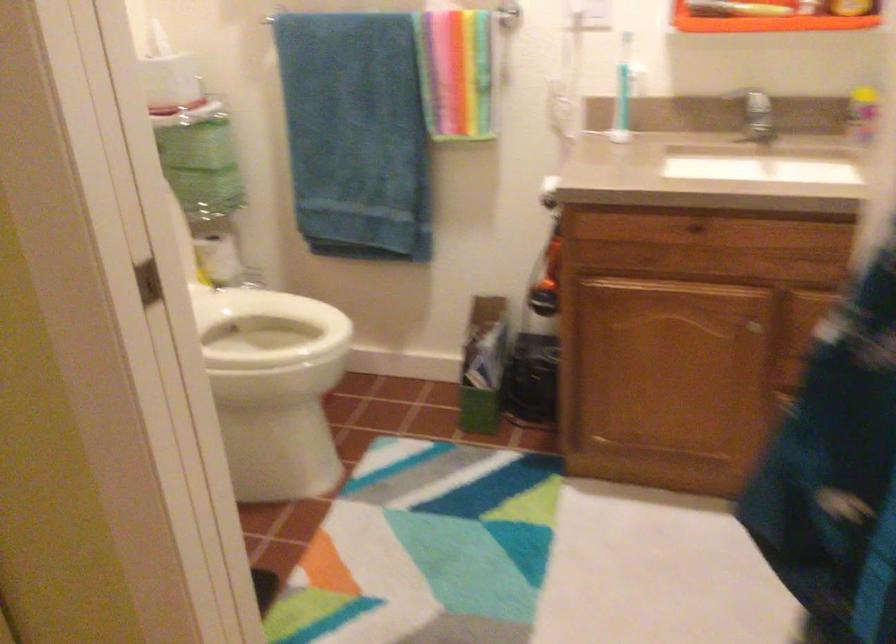
Which object does [196,145] point to?

This point indicates the green toilet paper roll.